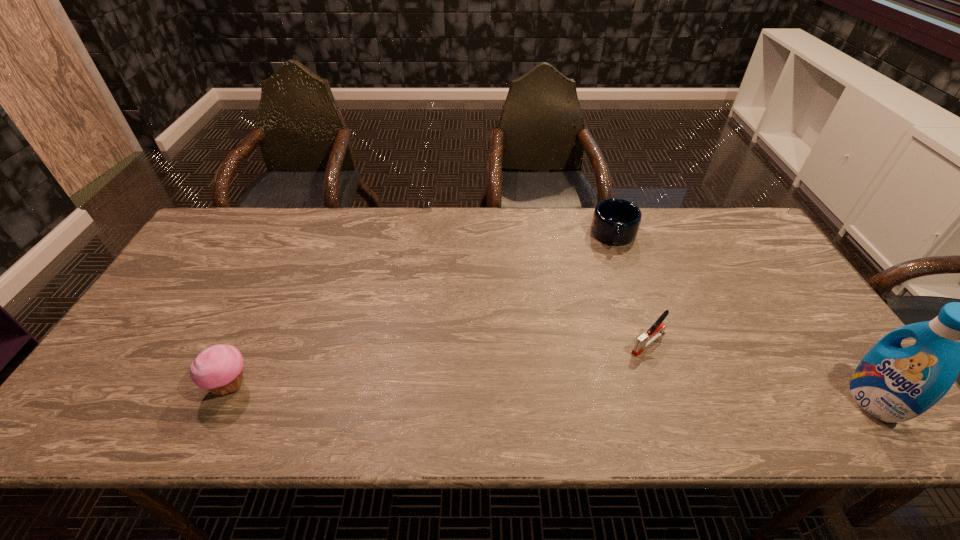
Locate an element on the screen. This screenshot has height=540, width=960. vacant spot on the desktop that is between the cupcake and the detergent and is positioned with the handle on the side of the mug is located at coordinates (612, 394).

This screenshot has height=540, width=960. What are the coordinates of `vacant space on the desktop that is between the third shortest object and the rightmost object and is positioned on the handle side of the third nearest object` in the screenshot? It's located at (585, 394).